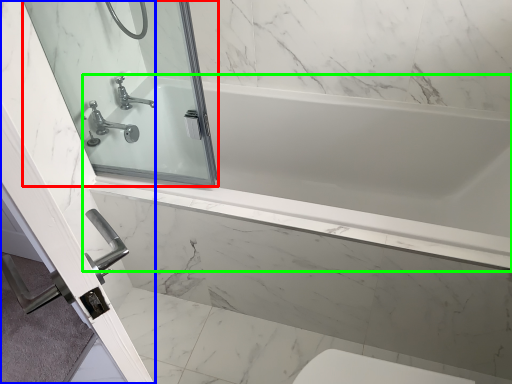
Question: Estimate the real-world distances between objects in this image. Which object is farther from mirror (highlighted by a red box), screen door (highlighted by a blue box) or bathtub (highlighted by a green box)?

Choices:
 (A) screen door
 (B) bathtub

Answer: (B)